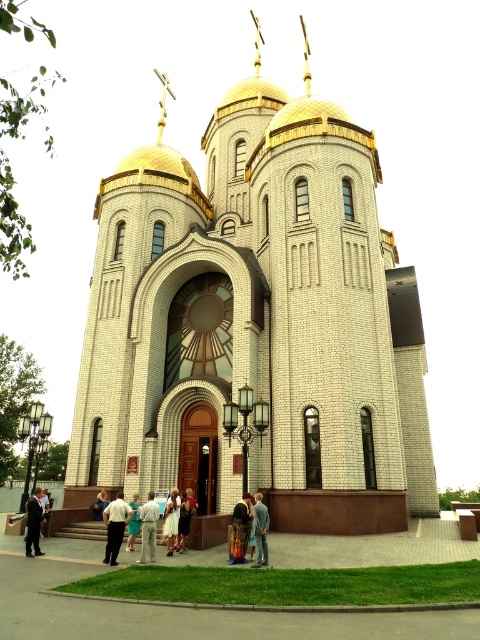
Between light beige pants at center and white cotton dress at center, which one has less height?

white cotton dress at center is shorter.

Looking at this image, does light beige pants at center lie in front of white cotton dress at center?

Yes, it is.

Locate an element on the screen. Image resolution: width=480 pixels, height=640 pixels. light beige pants at center is located at coordinates (148, 525).

Is white brick church at center taller than dark suit at lower left?

Yes, white brick church at center is taller than dark suit at lower left.

Who is more forward, (282, 218) or (29, 554)?

Point (29, 554)

Is point (218, 346) positioned before point (36, 515)?

No, it is not.

Where is `white brick church at center`? white brick church at center is located at coordinates (255, 324).

Can you confirm if dark gray fabric jacket at center is positioned below light brown fabric dress at lower center?

No.

Which is in front, point (250, 508) or point (194, 502)?

Point (250, 508) is more forward.

You are a GUI agent. You are given a task and a screenshot of the screen. Output one action in this format:
    pyautogui.click(x=<x>, y=<y>)
    Task: Click on the dark gray fabric jacket at center
    The image size is (480, 640).
    Given the screenshot: What is the action you would take?
    pyautogui.click(x=240, y=529)